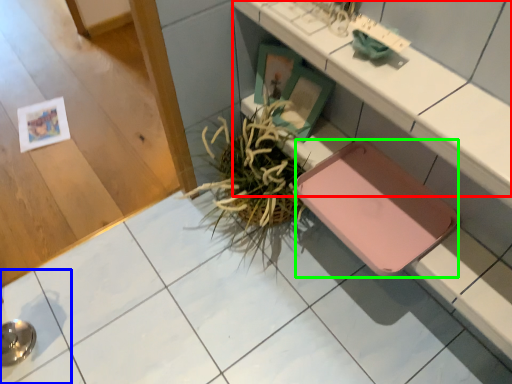
Question: Which is nearer to the counter (highlighted by a red box)? square (highlighted by a blue box) or pad (highlighted by a green box).

Choices:
 (A) square
 (B) pad

Answer: (B)